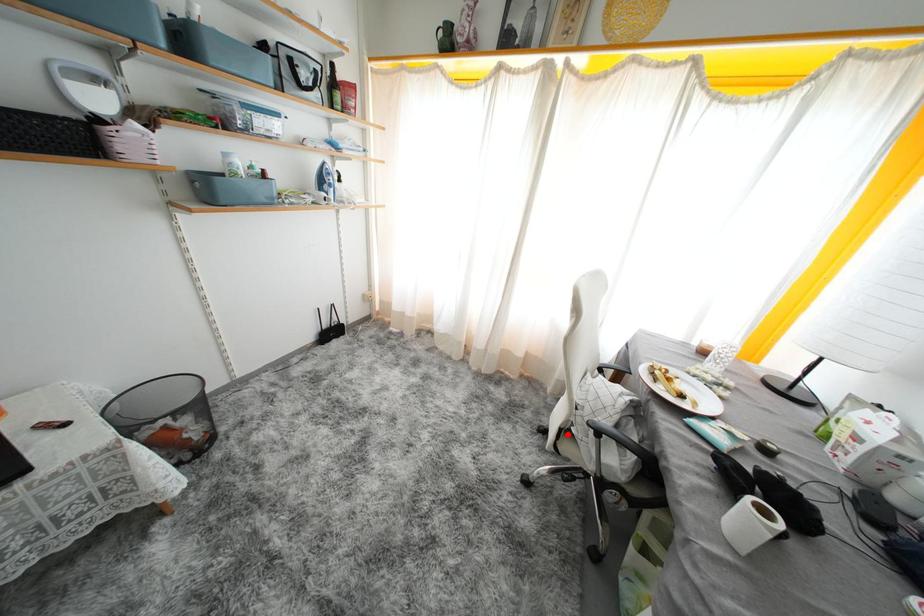
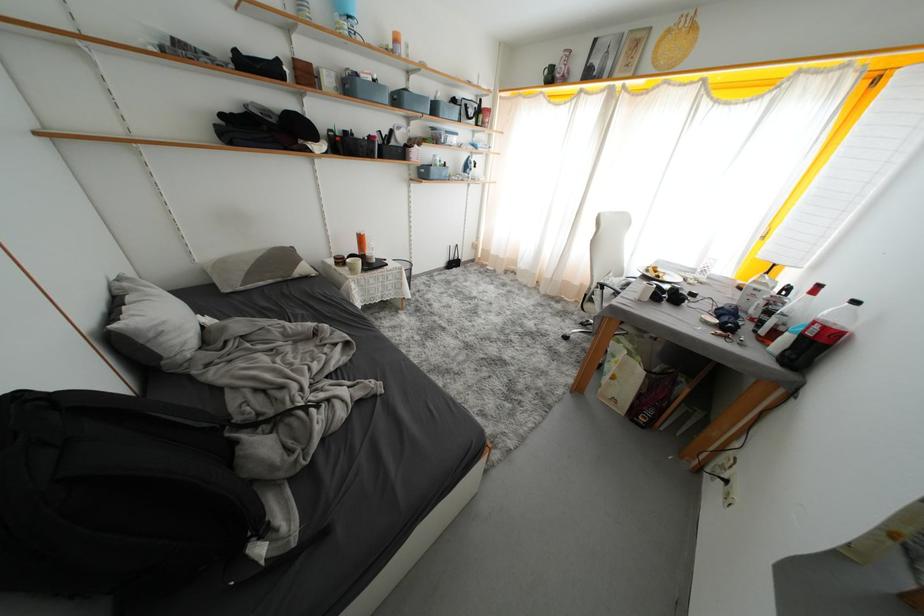
The point at the highlighted location is marked in the first image. Where is the corresponding point in the second image?

(591, 299)